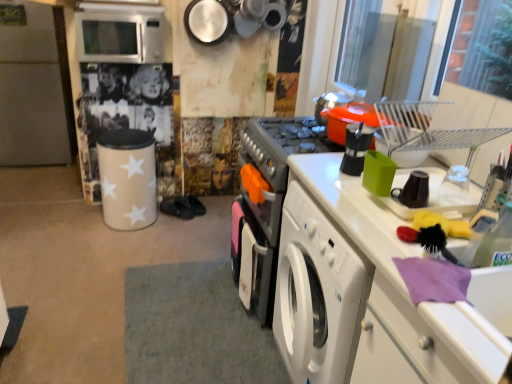
Measure the distance between white matte refrigerator at left and camera.

white matte refrigerator at left and camera are 2.95 meters apart.

This screenshot has height=384, width=512. What do you see at coordinates (35, 88) in the screenshot?
I see `white matte refrigerator at left` at bounding box center [35, 88].

This screenshot has height=384, width=512. In order to click on white matte refrigerator at left in this screenshot , I will do `click(35, 88)`.

Measure the distance between point (134, 40) and camera.

The depth of point (134, 40) is 2.40 meters.

Describe the element at coordinates (119, 33) in the screenshot. The width and height of the screenshot is (512, 384). I see `satin silver microwave at upper left` at that location.

What is the approximate width of satin silver microwave at upper left?

satin silver microwave at upper left is 14.85 inches in width.

Locate an element on the screen. satin silver microwave at upper left is located at coordinates (119, 33).

Find the location of `white matte refrigerator at left`. white matte refrigerator at left is located at coordinates (35, 88).

Can you confirm if satin silver microwave at upper left is positioned to the right of white matte refrigerator at left?

Yes.

Considering the relative positions of satin silver microwave at upper left and white matte refrigerator at left in the image provided, is satin silver microwave at upper left behind white matte refrigerator at left?

No, satin silver microwave at upper left is closer to the camera.

Which is behind, point (85, 6) or point (8, 98)?

Point (8, 98)

From the image's perspective, which is above, satin silver microwave at upper left or white matte refrigerator at left?

satin silver microwave at upper left appears higher in the image.

From a real-world perspective, does satin silver microwave at upper left sit lower than white matte refrigerator at left?

Incorrect, from a real-world perspective, satin silver microwave at upper left is higher than white matte refrigerator at left.

Considering the sizes of satin silver microwave at upper left and white matte refrigerator at left in the image, is satin silver microwave at upper left wider or thinner than white matte refrigerator at left?

Clearly, satin silver microwave at upper left has less width compared to white matte refrigerator at left.

Considering the relative sizes of satin silver microwave at upper left and white matte refrigerator at left in the image provided, is satin silver microwave at upper left shorter than white matte refrigerator at left?

Correct, satin silver microwave at upper left is not as tall as white matte refrigerator at left.

Considering the sizes of objects satin silver microwave at upper left and white matte refrigerator at left in the image provided, who is smaller, satin silver microwave at upper left or white matte refrigerator at left?

With smaller size is white matte refrigerator at left.

Would you say satin silver microwave at upper left contains white matte refrigerator at left?

No, white matte refrigerator at left is located outside of satin silver microwave at upper left.

Is the surface of satin silver microwave at upper left in direct contact with white matte refrigerator at left?

No, satin silver microwave at upper left is not in contact with white matte refrigerator at left.

Is satin silver microwave at upper left aimed at white matte refrigerator at left?

No, satin silver microwave at upper left is not aimed at white matte refrigerator at left.

How many degrees apart are the facing directions of satin silver microwave at upper left and white matte refrigerator at left?

The angular difference between satin silver microwave at upper left and white matte refrigerator at left is 90.4 degrees.

How much distance is there between satin silver microwave at upper left and white matte refrigerator at left?

A distance of 1.06 meters exists between satin silver microwave at upper left and white matte refrigerator at left.

Identify the location of fridge lying behind the satin silver microwave at upper left. The width and height of the screenshot is (512, 384). (35, 88).

Based on their positions, is white matte refrigerator at left located to the left or right of satin silver microwave at upper left?

Result: Clearly, white matte refrigerator at left is on the left of satin silver microwave at upper left in the image.

Which object is further away from the camera taking this photo, white matte refrigerator at left or satin silver microwave at upper left?

white matte refrigerator at left is further from the camera.

Is point (54, 163) positioned after point (80, 29)?

Yes, point (54, 163) is farther from viewer.

From the image's perspective, does white matte refrigerator at left appear higher than satin silver microwave at upper left?

Incorrect, from the image's perspective, white matte refrigerator at left is lower than satin silver microwave at upper left.

From a real-world perspective, is white matte refrigerator at left physically located above or below satin silver microwave at upper left?

From a real-world perspective, white matte refrigerator at left is physically below satin silver microwave at upper left.

Which of these two, white matte refrigerator at left or satin silver microwave at upper left, is thinner?

With smaller width is satin silver microwave at upper left.

Who is taller, white matte refrigerator at left or satin silver microwave at upper left?

white matte refrigerator at left.

Considering the relative sizes of white matte refrigerator at left and satin silver microwave at upper left in the image provided, is white matte refrigerator at left smaller than satin silver microwave at upper left?

Yes, white matte refrigerator at left is smaller than satin silver microwave at upper left.

Is satin silver microwave at upper left a part of white matte refrigerator at left?

No, satin silver microwave at upper left is located outside of white matte refrigerator at left.

From the picture: Would you say white matte refrigerator at left is a long distance from satin silver microwave at upper left?

Yes, white matte refrigerator at left and satin silver microwave at upper left are quite far apart.

Is white matte refrigerator at left oriented towards satin silver microwave at upper left?

No, white matte refrigerator at left is not facing towards satin silver microwave at upper left.

What's the angular difference between white matte refrigerator at left and satin silver microwave at upper left's facing directions?

The angle between the facing direction of white matte refrigerator at left and the facing direction of satin silver microwave at upper left is 90.4 degrees.

You are a GUI agent. You are given a task and a screenshot of the screen. Output one action in this format:
    pyautogui.click(x=<x>, y=<y>)
    Task: Click on the microwave oven lying above the white matte refrigerator at left (from the image's perspective)
    The height and width of the screenshot is (384, 512).
    Given the screenshot: What is the action you would take?
    pyautogui.click(x=119, y=33)

Image resolution: width=512 pixels, height=384 pixels. Find the location of `fridge that appears on the left of satin silver microwave at upper left`. fridge that appears on the left of satin silver microwave at upper left is located at coordinates (35, 88).

Where is `microwave oven on the right side of white matte refrigerator at left`? microwave oven on the right side of white matte refrigerator at left is located at coordinates (119, 33).